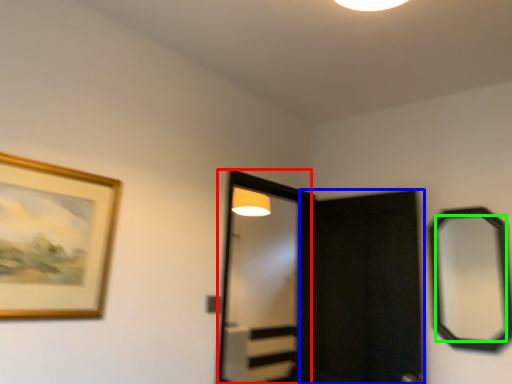
Question: Which is farther away from screen door (highlighted by a red box)? screen door (highlighted by a blue box) or mirror (highlighted by a green box)?

Choices:
 (A) screen door
 (B) mirror

Answer: (B)